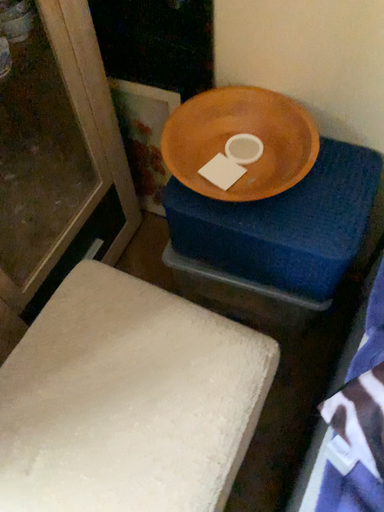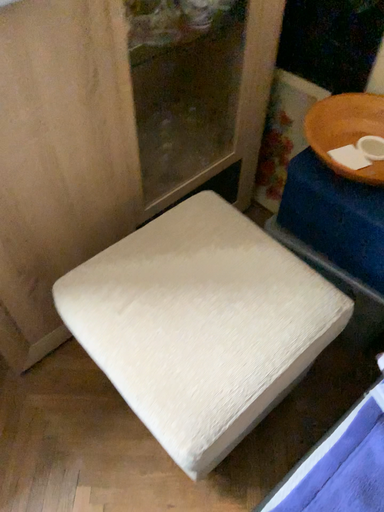
Question: Which way did the camera rotate in the video?

Choices:
 (A) rotated left
 (B) rotated right

Answer: (A)